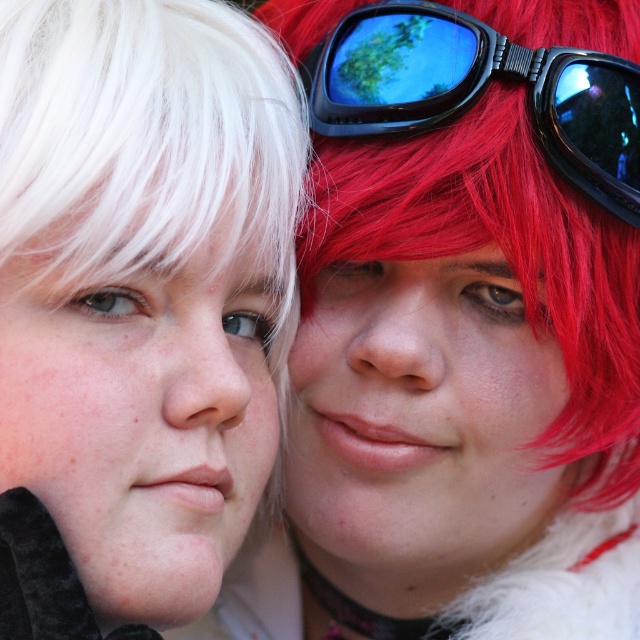
Question: Does white matte wig at left appear over black glossy goggles at upper right?

Choices:
 (A) no
 (B) yes

Answer: (A)

Question: Among these points, which one is farthest from the camera?

Choices:
 (A) (464, 35)
 (B) (445, 392)

Answer: (A)

Question: Considering the real-world distances, which object is closest to the black glossy goggles at upper right?

Choices:
 (A) white matte wig at left
 (B) shiny red wig at center

Answer: (B)

Question: Estimate the real-world distances between objects in this image. Which object is closer to the black glossy goggles at upper right?

Choices:
 (A) white matte wig at left
 (B) shiny red wig at center

Answer: (B)

Question: Can you confirm if shiny red wig at center is positioned below black glossy goggles at upper right?

Choices:
 (A) no
 (B) yes

Answer: (B)

Question: Does shiny red wig at center have a smaller size compared to black glossy goggles at upper right?

Choices:
 (A) no
 (B) yes

Answer: (A)